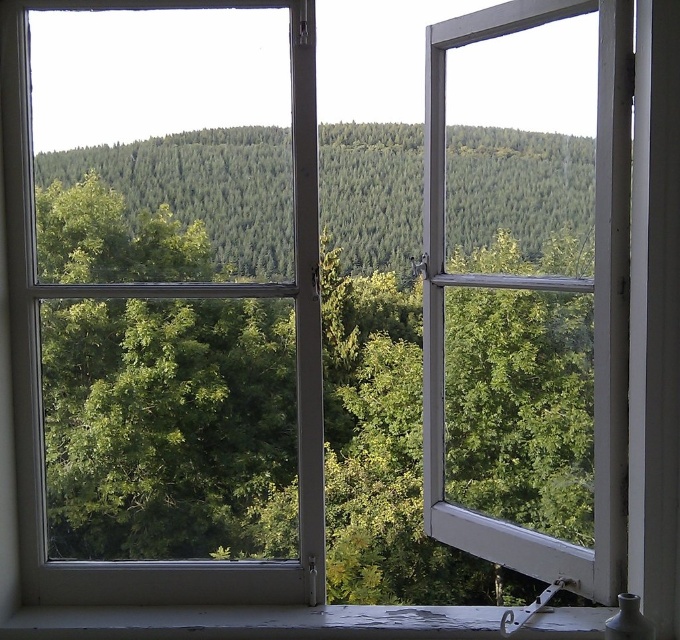
Looking at this image, you are an interior designer assessing the view from this window. You need to determine if the green forested hill at center can fit entirely within the frame of the white painted wood at lower center when viewed from inside. Can it?

The green forested hill at center has a width less than the white painted wood at lower center, so yes, the green forested hill at center can fit entirely within the frame of the white painted wood at lower center.

You are standing in a room and looking through the partially open window. You want to estimate how far the green forested hill at center is from you. Based on the scene, can you provide an approximate distance?

The green forested hill at center is approximately 15.88 feet away from the viewer.